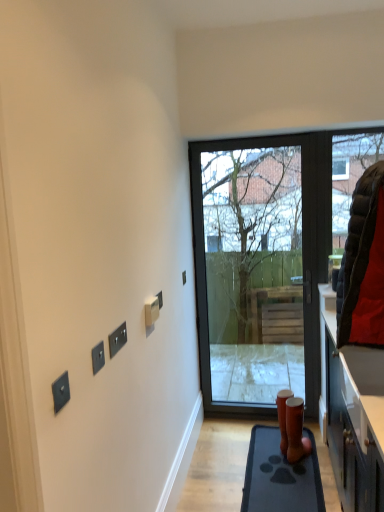
Question: Is matte black door at center far from rubber mat at lower right?

Choices:
 (A) no
 (B) yes

Answer: (B)

Question: Is matte black door at center turned away from rubber mat at lower right?

Choices:
 (A) yes
 (B) no

Answer: (B)

Question: Does matte black door at center have a lesser height compared to rubber mat at lower right?

Choices:
 (A) yes
 (B) no

Answer: (B)

Question: Can you confirm if matte black door at center is wider than rubber mat at lower right?

Choices:
 (A) yes
 (B) no

Answer: (B)

Question: From the image's perspective, is matte black door at center under rubber mat at lower right?

Choices:
 (A) yes
 (B) no

Answer: (B)

Question: Looking at the image, does satin black switch at lower left, placed as the first electric outlet when sorted from left to right, seem bigger or smaller compared to black plastic switch at center, the fifth electric outlet from the front?

Choices:
 (A) big
 (B) small

Answer: (B)

Question: Considering the positions of satin black switch at lower left, placed as the first electric outlet when sorted from left to right, and black plastic switch at center, which is the first electric outlet in right-to-left order, in the image, is satin black switch at lower left, placed as the first electric outlet when sorted from left to right, wider or thinner than black plastic switch at center, which is the first electric outlet in right-to-left order,?

Choices:
 (A) thin
 (B) wide

Answer: (A)

Question: Considering the relative positions of satin black switch at lower left, positioned as the 1th electric outlet in front-to-back order, and black plastic switch at center, which is the first electric outlet in right-to-left order, in the image provided, is satin black switch at lower left, positioned as the 1th electric outlet in front-to-back order, to the left or to the right of black plastic switch at center, which is the first electric outlet in right-to-left order,?

Choices:
 (A) left
 (B) right

Answer: (A)

Question: From the image's perspective, is satin black switch at lower left, positioned as the 1th electric outlet in front-to-back order, above or below black plastic switch at center, which is the first electric outlet in right-to-left order?

Choices:
 (A) below
 (B) above

Answer: (A)

Question: Is point (97, 348) positioned closer to the camera than point (193, 155)?

Choices:
 (A) closer
 (B) farther

Answer: (A)

Question: Considering the positions of satin black switch at upper left, the 2th electric outlet in the left-to-right sequence, and matte black door at center in the image, is satin black switch at upper left, the 2th electric outlet in the left-to-right sequence, wider or thinner than matte black door at center?

Choices:
 (A) thin
 (B) wide

Answer: (A)

Question: From a real-world perspective, is satin black switch at upper left, the 4th electric outlet from the back, positioned above or below matte black door at center?

Choices:
 (A) above
 (B) below

Answer: (A)

Question: Would you say satin black switch at upper left, the 4th electric outlet from the back, is to the left or to the right of matte black door at center in the picture?

Choices:
 (A) right
 (B) left

Answer: (B)

Question: Is rubber mat at lower right taller or shorter than black matte switch at upper center, the third electric outlet in the back-to-front sequence?

Choices:
 (A) short
 (B) tall

Answer: (A)

Question: Based on their positions, is rubber mat at lower right located to the left or right of black matte switch at upper center, the 3th electric outlet viewed from the left?

Choices:
 (A) left
 (B) right

Answer: (B)